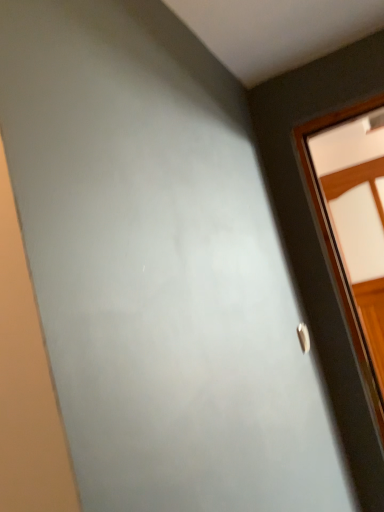
Question: From the image's perspective, relative to silver metallic door handle at right, is wooden window at right above or below?

Choices:
 (A) above
 (B) below

Answer: (A)

Question: Relative to silver metallic door handle at right, is wooden window at right in front or behind?

Choices:
 (A) behind
 (B) front

Answer: (A)

Question: Does point (377, 139) appear closer or farther from the camera than point (306, 335)?

Choices:
 (A) closer
 (B) farther

Answer: (B)

Question: From a real-world perspective, relative to wooden window at right, is silver metallic door handle at right vertically above or below?

Choices:
 (A) above
 (B) below

Answer: (B)

Question: Considering the positions of point (306, 342) and point (354, 284), is point (306, 342) closer or farther from the camera than point (354, 284)?

Choices:
 (A) farther
 (B) closer

Answer: (B)

Question: From their relative heights in the image, would you say silver metallic door handle at right is taller or shorter than wooden window at right?

Choices:
 (A) tall
 (B) short

Answer: (B)

Question: Based on their positions, is silver metallic door handle at right located to the left or right of wooden window at right?

Choices:
 (A) left
 (B) right

Answer: (A)